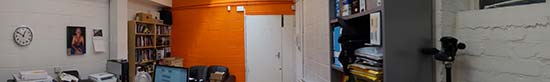
Locate an element on the screen. Image resolution: width=550 pixels, height=82 pixels. files is located at coordinates (364, 62).